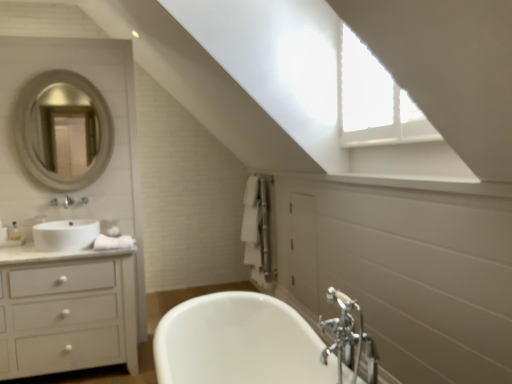
Question: Is white glossy cabinet at left bigger than chrome metallic faucet at lower right?

Choices:
 (A) no
 (B) yes

Answer: (B)

Question: Is white glossy cabinet at left oriented away from chrome metallic faucet at lower right?

Choices:
 (A) no
 (B) yes

Answer: (A)

Question: Are white glossy cabinet at left and chrome metallic faucet at lower right making contact?

Choices:
 (A) no
 (B) yes

Answer: (A)

Question: Is white glossy cabinet at left further to the viewer compared to chrome metallic faucet at lower right?

Choices:
 (A) yes
 (B) no

Answer: (A)

Question: Is white glossy cabinet at left wider than chrome metallic faucet at lower right?

Choices:
 (A) yes
 (B) no

Answer: (A)

Question: Does white glossy cabinet at left contain chrome metallic faucet at lower right?

Choices:
 (A) no
 (B) yes

Answer: (A)

Question: From a real-world perspective, is silver metallic mirror at upper left beneath white glossy sink at left?

Choices:
 (A) yes
 (B) no

Answer: (B)

Question: Is silver metallic mirror at upper left wider than white glossy sink at left?

Choices:
 (A) yes
 (B) no

Answer: (B)

Question: From a real-world perspective, is silver metallic mirror at upper left positioned over white glossy sink at left based on gravity?

Choices:
 (A) yes
 (B) no

Answer: (A)

Question: From the image's perspective, is silver metallic mirror at upper left beneath white glossy sink at left?

Choices:
 (A) no
 (B) yes

Answer: (A)

Question: Considering the relative sizes of silver metallic mirror at upper left and white glossy sink at left in the image provided, is silver metallic mirror at upper left shorter than white glossy sink at left?

Choices:
 (A) yes
 (B) no

Answer: (B)

Question: Does silver metallic mirror at upper left come in front of white glossy sink at left?

Choices:
 (A) no
 (B) yes

Answer: (A)

Question: Considering the relative sizes of white glossy cabinet at left and silver metallic mirror at upper left in the image provided, is white glossy cabinet at left bigger than silver metallic mirror at upper left?

Choices:
 (A) yes
 (B) no

Answer: (A)